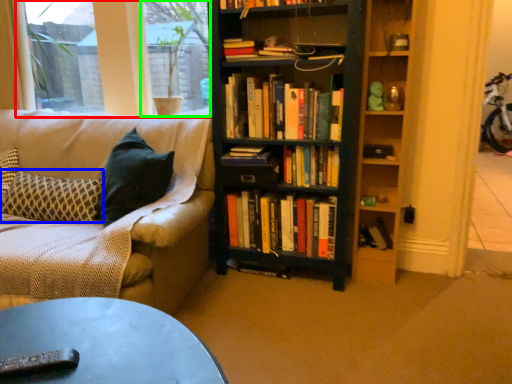
Question: Which is farther away from window screen (highlighted by a red box)? pillow (highlighted by a blue box) or window screen (highlighted by a green box)?

Choices:
 (A) pillow
 (B) window screen

Answer: (A)